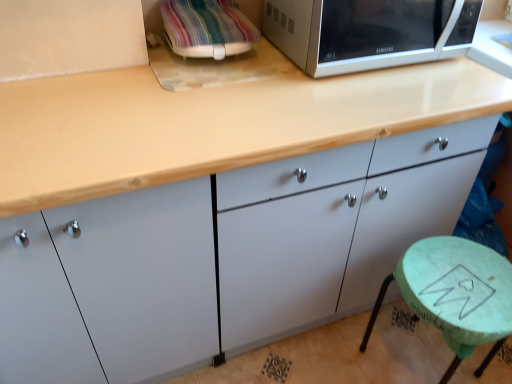
Question: Can you confirm if green marble stool at lower right is thinner than satin silver microwave at upper right?

Choices:
 (A) no
 (B) yes

Answer: (B)

Question: Can you confirm if green marble stool at lower right is positioned to the right of satin silver microwave at upper right?

Choices:
 (A) no
 (B) yes

Answer: (B)

Question: Is green marble stool at lower right wider than satin silver microwave at upper right?

Choices:
 (A) yes
 (B) no

Answer: (B)

Question: From a real-world perspective, is green marble stool at lower right on top of satin silver microwave at upper right?

Choices:
 (A) yes
 (B) no

Answer: (B)

Question: Is the depth of green marble stool at lower right greater than that of satin silver microwave at upper right?

Choices:
 (A) yes
 (B) no

Answer: (A)

Question: Does green marble stool at lower right contain satin silver microwave at upper right?

Choices:
 (A) no
 (B) yes

Answer: (A)

Question: Is green marble stool at lower right located within multicolored fabric-covered microwave at upper right?

Choices:
 (A) no
 (B) yes

Answer: (A)

Question: Is multicolored fabric-covered microwave at upper right touching green marble stool at lower right?

Choices:
 (A) yes
 (B) no

Answer: (B)

Question: Could you tell me if multicolored fabric-covered microwave at upper right is turned towards green marble stool at lower right?

Choices:
 (A) no
 (B) yes

Answer: (A)

Question: Is the position of multicolored fabric-covered microwave at upper right less distant than that of green marble stool at lower right?

Choices:
 (A) no
 (B) yes

Answer: (A)

Question: Can we say multicolored fabric-covered microwave at upper right lies outside green marble stool at lower right?

Choices:
 (A) yes
 (B) no

Answer: (A)

Question: Does multicolored fabric-covered microwave at upper right come behind green marble stool at lower right?

Choices:
 (A) yes
 (B) no

Answer: (A)

Question: Would you say multicolored fabric-covered microwave at upper right is a long distance from matte white cabinet at center?

Choices:
 (A) no
 (B) yes

Answer: (A)